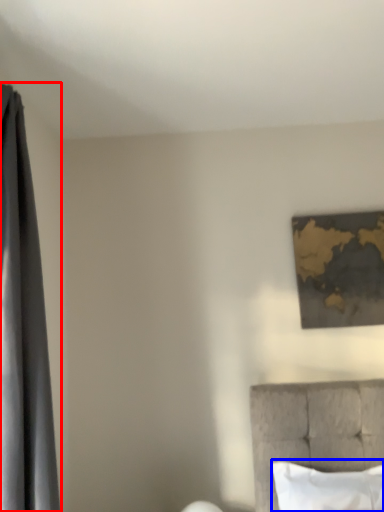
Question: Among these objects, which one is farthest to the camera, curtain (highlighted by a red box) or pillow (highlighted by a blue box)?

Choices:
 (A) curtain
 (B) pillow

Answer: (B)